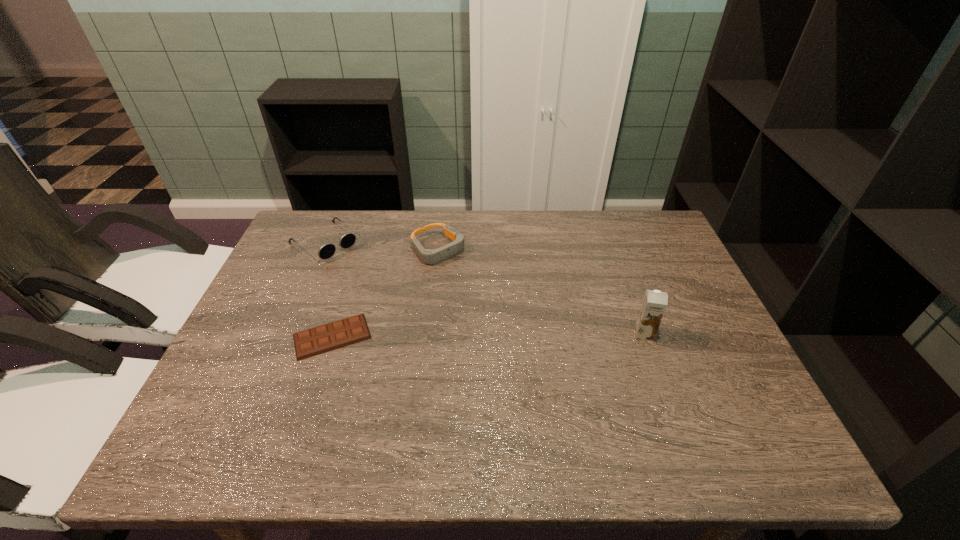
Locate an element on the screen. The image size is (960, 540). vacant region at the left edge of the desktop is located at coordinates (224, 359).

This screenshot has width=960, height=540. In the image, there is a desktop. Identify the location of vacant space at the right edge. tap(631, 270).

Where is `vacant point at the near left corner`? Image resolution: width=960 pixels, height=540 pixels. vacant point at the near left corner is located at coordinates (214, 416).

Identify the location of vacant space at the near right corner of the desktop. coord(741,413).

Locate an element on the screen. The image size is (960, 540). unoccupied area between the chocolate milk and the sunglasses is located at coordinates (484, 288).

I want to click on unoccupied position between the goggles and the shortest object, so click(385, 293).

Identify the location of free spot between the tallest object and the third object from left to right. Image resolution: width=960 pixels, height=540 pixels. (540, 292).

This screenshot has width=960, height=540. Identify the location of vacant area that lies between the goggles and the shortest object. (385, 293).

At what (x,y) coordinates should I click in order to perform the action: click on free space between the sunglasses and the chocolate bar. Please return your answer as a coordinate pair (x, y). The width and height of the screenshot is (960, 540). Looking at the image, I should click on (328, 289).

The width and height of the screenshot is (960, 540). I want to click on free area in between the chocolate bar and the sunglasses, so click(328, 289).